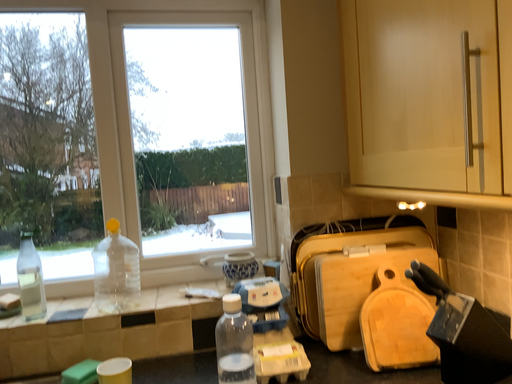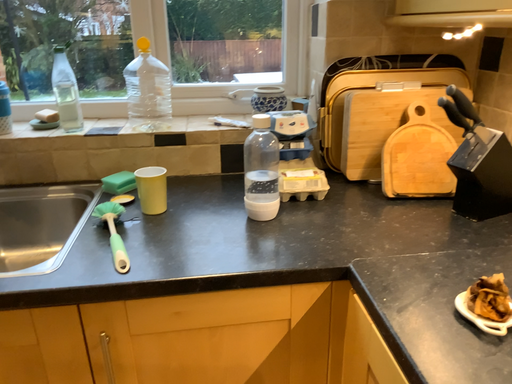
Question: How did the camera likely rotate when shooting the video?

Choices:
 (A) rotated downward
 (B) rotated upward

Answer: (A)